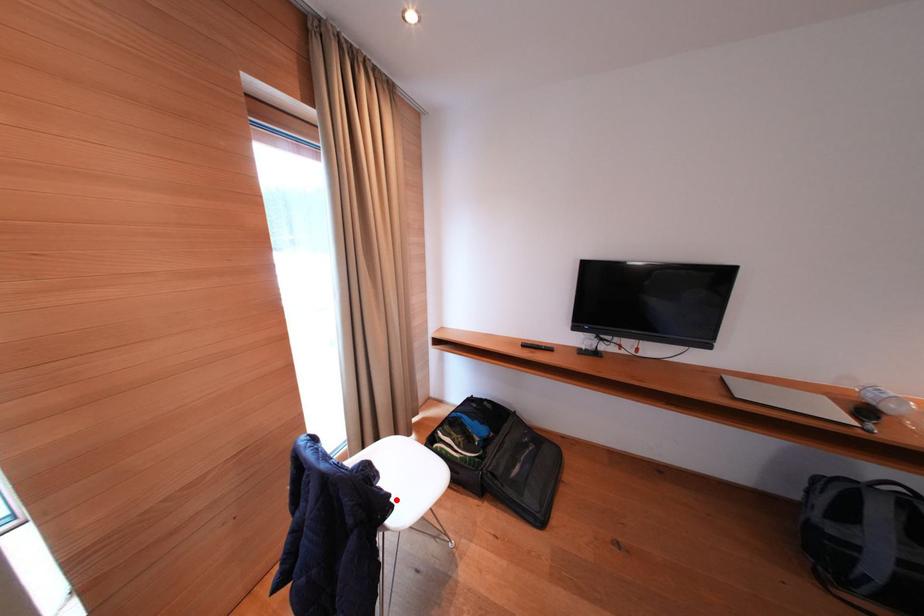
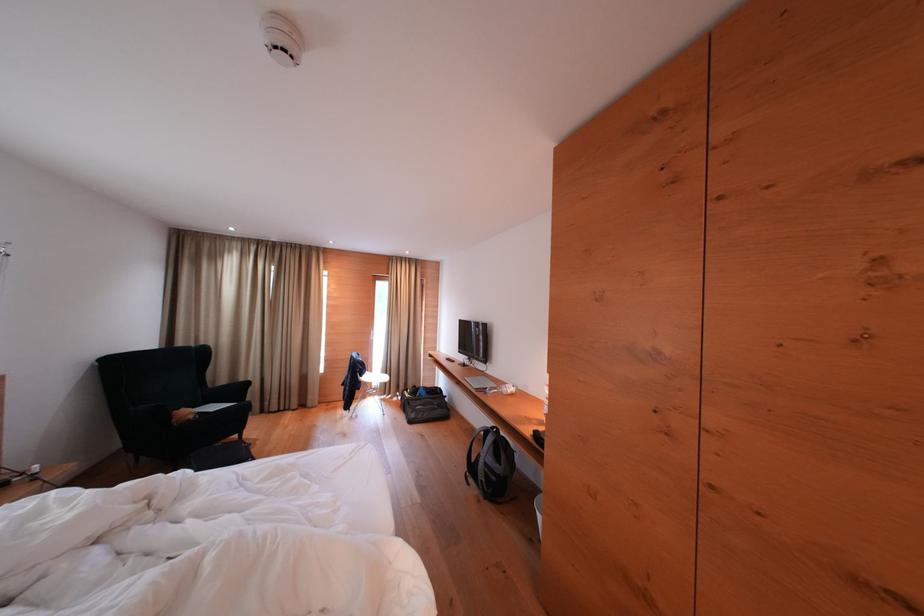
Locate, in the second image, the point that corresponds to the highlighted location in the first image.

(369, 373)